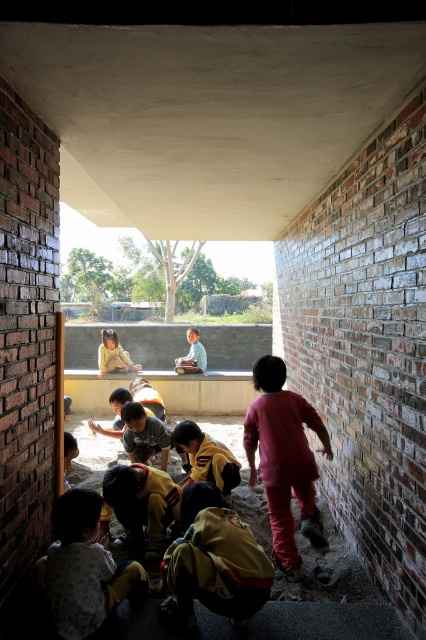
You are a parent trying to locate your child who is wearing pink matte pants at lower right and another child wearing matte yellow shirt at center. How far apart are these two children?

The pink matte pants at lower right and matte yellow shirt at center are 14.01 feet apart.

You are a photographer trying to capture a group photo of the children in the unfinished building. You notice two children wearing a matte yellow shirt at center and a light blue shirt at center. Which child should you position closer to the camera to ensure their entire shirt is visible in the photo?

You should position the matte yellow shirt at center closer to the camera because its width is larger than the light blue shirt at center, making it easier to capture the entire shirt in the photo when closer.